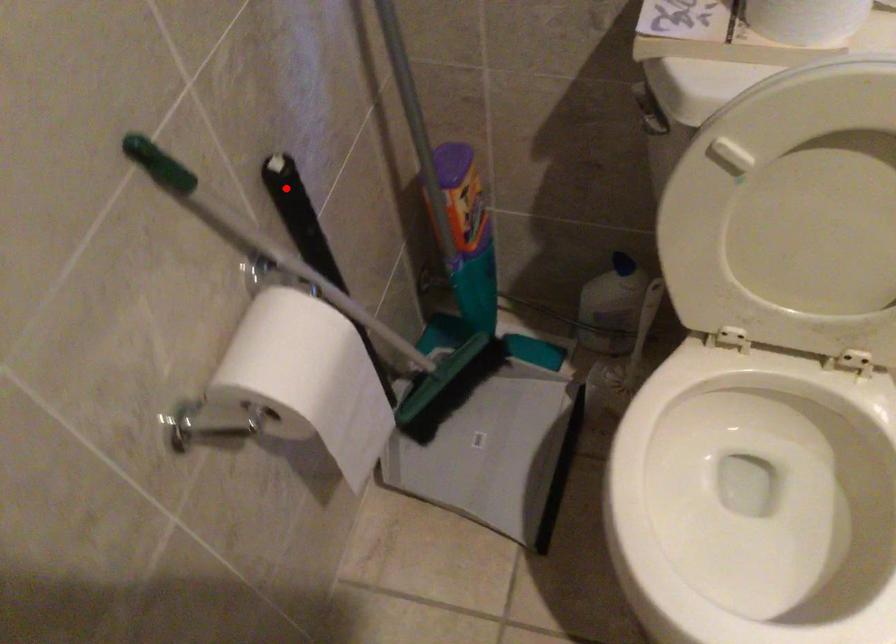
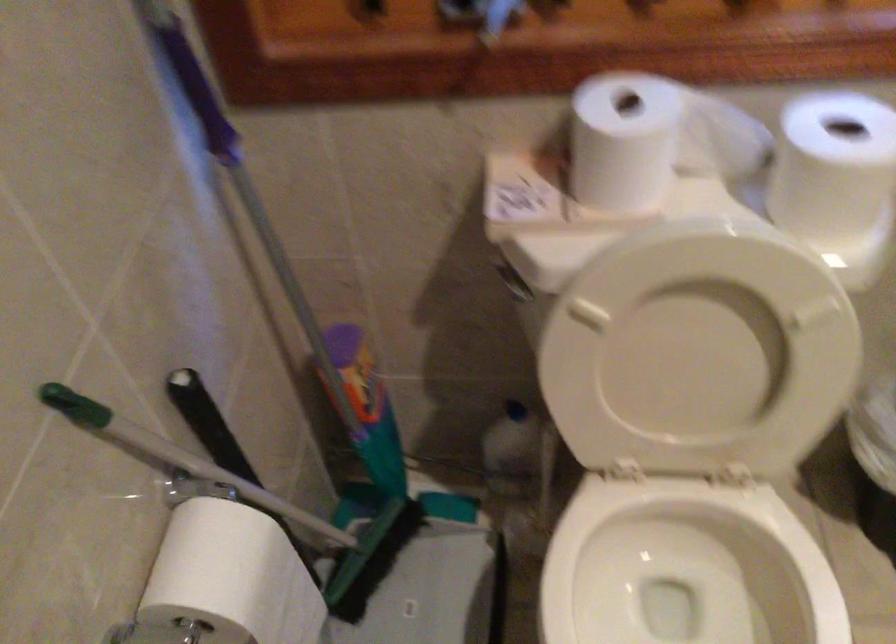
In the second image, find the point that corresponds to the highlighted location in the first image.

(194, 402)